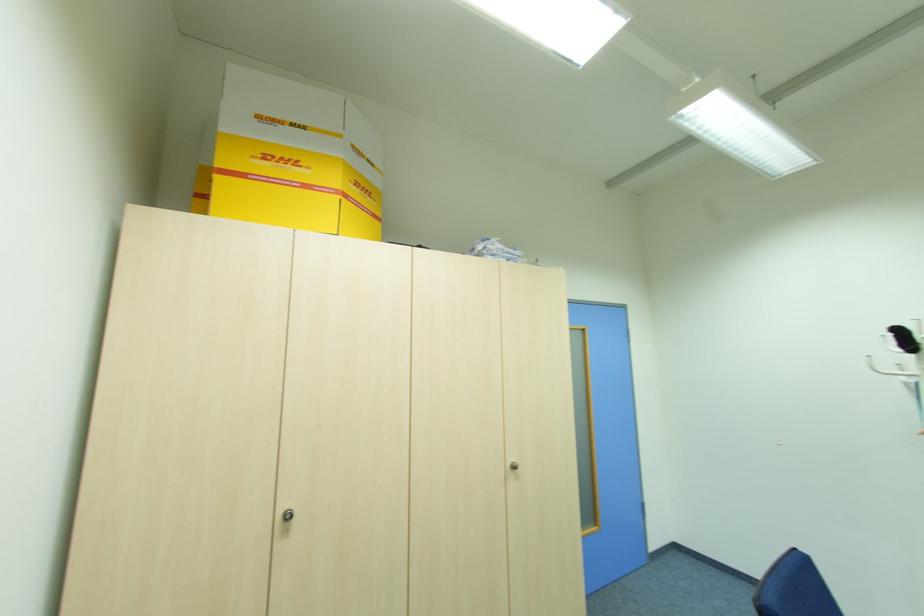
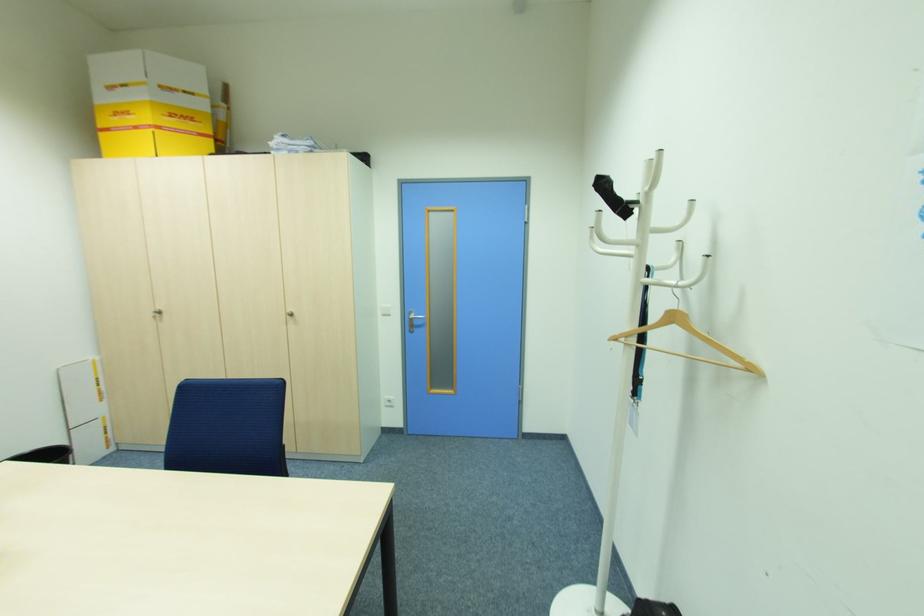
Locate, in the second image, the point that corresponds to point (513, 460) in the first image.

(292, 310)